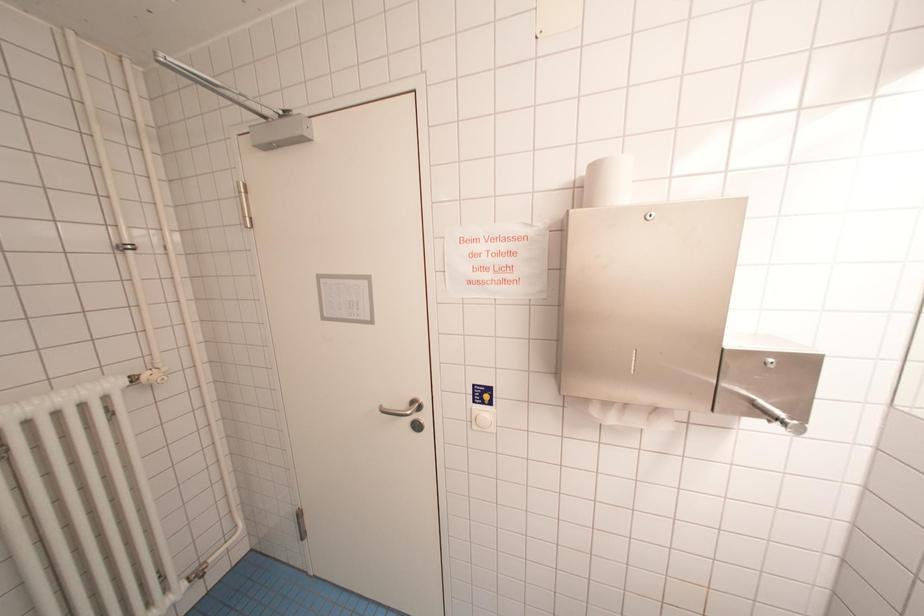
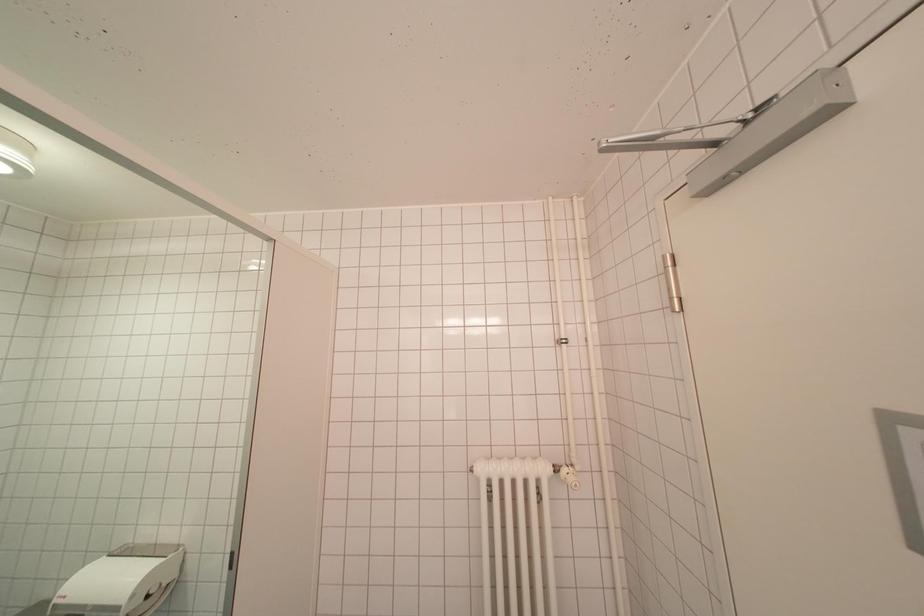
Question: The images are taken continuously from a first-person perspective. In which direction is your viewpoint rotating?

Choices:
 (A) Left
 (B) Right
 (C) Up
 (D) Down

Answer: (A)